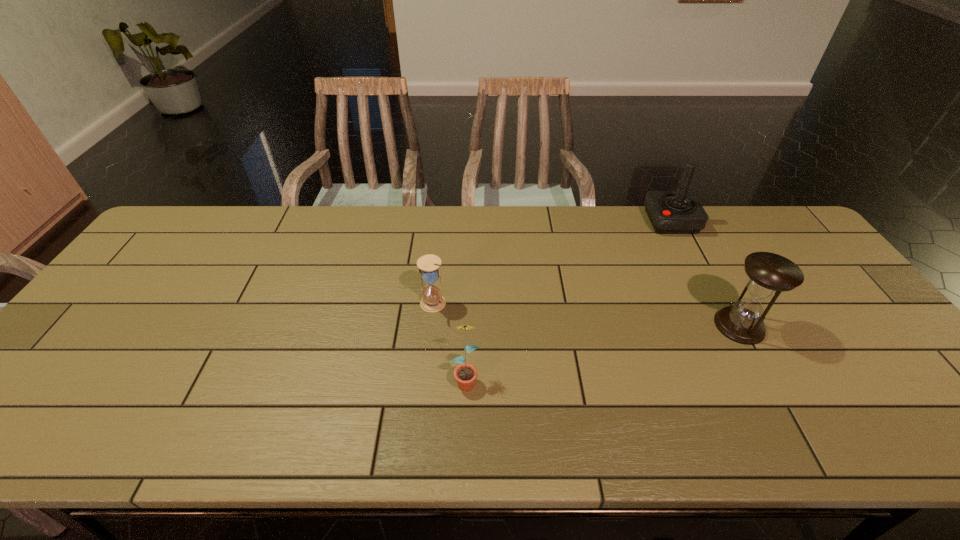
Where is `vacant area located 0.060m on the flower of the third object from right to left`? vacant area located 0.060m on the flower of the third object from right to left is located at coordinates (465, 419).

Locate an element on the screen. The width and height of the screenshot is (960, 540). vacant space located on the back of the left hourglass is located at coordinates (441, 232).

Image resolution: width=960 pixels, height=540 pixels. What are the coordinates of `object that is at the far edge` in the screenshot? It's located at (670, 212).

The width and height of the screenshot is (960, 540). What are the coordinates of `vacant space at the far edge of the desktop` in the screenshot? It's located at (256, 219).

Image resolution: width=960 pixels, height=540 pixels. In order to click on free region at the near edge of the desktop in this screenshot , I will do tap(519, 420).

In the image, there is a desktop. At what (x,y) coordinates should I click in order to perform the action: click on free space at the left edge. Please return your answer as a coordinate pair (x, y). This screenshot has height=540, width=960. Looking at the image, I should click on (105, 340).

In the image, there is a desktop. Find the location of `free space at the right edge`. free space at the right edge is located at coordinates (924, 387).

Where is `free point at the far left corner`? The height and width of the screenshot is (540, 960). free point at the far left corner is located at coordinates point(183,216).

Locate an element on the screen. vacant area at the far right corner is located at coordinates pyautogui.click(x=765, y=239).

In the image, there is a desktop. Where is `vacant space at the near right corner`? This screenshot has height=540, width=960. vacant space at the near right corner is located at coordinates (922, 415).